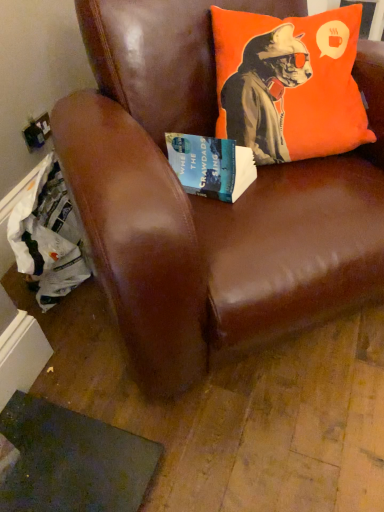
What do you see at coordinates (208, 199) in the screenshot? The image size is (384, 512). I see `brown leather chair at upper center` at bounding box center [208, 199].

What do you see at coordinates (211, 165) in the screenshot? The height and width of the screenshot is (512, 384). I see `hardcover book at center` at bounding box center [211, 165].

This screenshot has height=512, width=384. I want to click on brown leather chair at upper center, so click(x=208, y=199).

Image resolution: width=384 pixels, height=512 pixels. Identify the location of pillow above the brown leather chair at upper center (from a real-world perspective). (289, 84).

Can you see orange fabric pillow at upper right touching brown leather chair at upper center?

No, orange fabric pillow at upper right is not with brown leather chair at upper center.

From the picture: Could brown leather chair at upper center be considered to be inside orange fabric pillow at upper right?

No.

Between point (146, 48) and point (246, 122), which one is positioned in front?

The point (246, 122) is closer.

Could you tell me if brown leather chair at upper center is turned towards orange fabric pillow at upper right?

Yes.

Is brown leather chair at upper center taller than orange fabric pillow at upper right?

Indeed, brown leather chair at upper center has a greater height compared to orange fabric pillow at upper right.

Is brown leather chair at upper center wider than orange fabric pillow at upper right?

Correct, the width of brown leather chair at upper center exceeds that of orange fabric pillow at upper right.

From the image's perspective, is brown leather chair at upper center on hardcover book at center?

Yes.

Does point (132, 259) come in front of point (209, 143)?

Yes, it is in front of point (209, 143).

Is brown leather chair at upper center positioned with its back to hardcover book at center?

Correct, brown leather chair at upper center is looking away from hardcover book at center.

Can you tell me how much brown leather chair at upper center and hardcover book at center differ in facing direction?

The facing directions of brown leather chair at upper center and hardcover book at center are 32.1 degrees apart.

How different are the orientations of hardcover book at center and orange fabric pillow at upper right in degrees?

There is a 62.7-degree angle between the facing directions of hardcover book at center and orange fabric pillow at upper right.

Considering their positions, is hardcover book at center located in front of or behind orange fabric pillow at upper right?

hardcover book at center is positioned farther from the viewer than orange fabric pillow at upper right.

Do you think hardcover book at center is within orange fabric pillow at upper right, or outside of it?

hardcover book at center exists outside the volume of orange fabric pillow at upper right.

Is orange fabric pillow at upper right in front of or behind hardcover book at center in the image?

orange fabric pillow at upper right is positioned closer to the viewer than hardcover book at center.

Which of these two, orange fabric pillow at upper right or hardcover book at center, is thinner?

Thinner between the two is hardcover book at center.

Is hardcover book at center at the back of orange fabric pillow at upper right?

No, orange fabric pillow at upper right's orientation is not away from hardcover book at center.

Does point (288, 100) appear closer or farther from the camera than point (228, 191)?

Point (288, 100) is positioned farther from the camera compared to point (228, 191).

Is hardcover book at center inside or outside of brown leather chair at upper center?

hardcover book at center fits inside brown leather chair at upper center.

Is hardcover book at center placed right next to brown leather chair at upper center?

hardcover book at center and brown leather chair at upper center are clearly separated.

In order to click on chair lying in front of the hardcover book at center in this screenshot , I will do `click(208, 199)`.

Is point (254, 173) in front of point (156, 291)?

No.

Locate an element on the screen. chair in front of the orange fabric pillow at upper right is located at coordinates (208, 199).

You are a GUI agent. You are given a task and a screenshot of the screen. Output one action in this format:
    pyautogui.click(x=<x>, y=<y>)
    Task: Click on the pillow located on the right of brown leather chair at upper center
    
    Given the screenshot: What is the action you would take?
    pyautogui.click(x=289, y=84)

Looking at the image, which one is located closer to hardcover book at center, brown leather chair at upper center or orange fabric pillow at upper right?

orange fabric pillow at upper right lies closer to hardcover book at center than the other object.

Estimate the real-world distances between objects in this image. Which object is closer to hardcover book at center, orange fabric pillow at upper right or brown leather chair at upper center?

orange fabric pillow at upper right is positioned closer to the anchor hardcover book at center.

Considering their positions, is brown leather chair at upper center positioned closer to orange fabric pillow at upper right than hardcover book at center?

brown leather chair at upper center is closer to orange fabric pillow at upper right.

Looking at the image, which one is located further to brown leather chair at upper center, orange fabric pillow at upper right or hardcover book at center?

hardcover book at center.

Estimate the real-world distances between objects in this image. Which object is closer to brown leather chair at upper center, hardcover book at center or orange fabric pillow at upper right?

The object closer to brown leather chair at upper center is orange fabric pillow at upper right.

From the image, which object appears to be farther from orange fabric pillow at upper right, hardcover book at center or brown leather chair at upper center?

Among the two, hardcover book at center is located further to orange fabric pillow at upper right.

Identify the location of pillow between brown leather chair at upper center and hardcover book at center in the front-back direction. (289, 84).